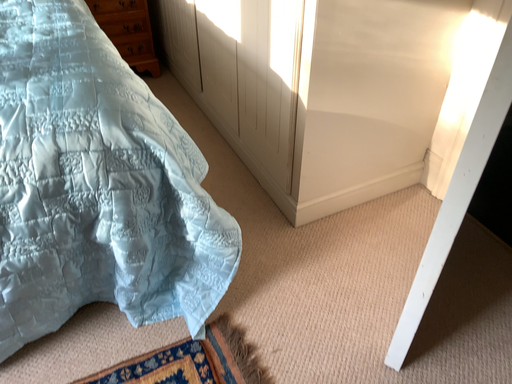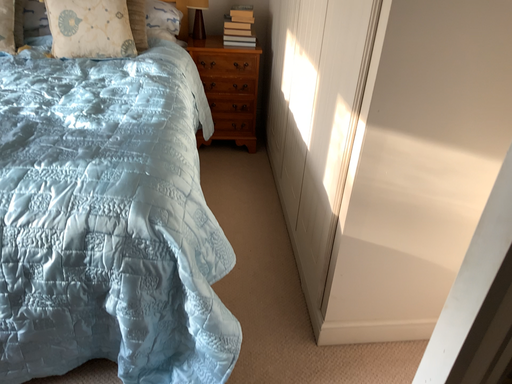
Question: Which way did the camera rotate in the video?

Choices:
 (A) rotated right
 (B) rotated left

Answer: (B)